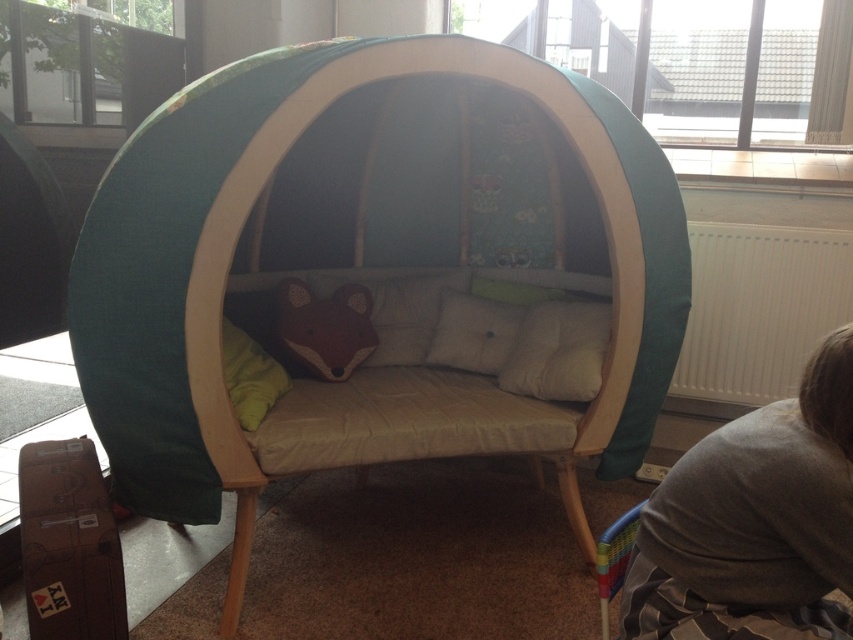
Between brown cardboard suitcase at lower left and beige fabric pillow at center, which one is positioned lower?

Positioned lower is brown cardboard suitcase at lower left.

Identify the location of brown cardboard suitcase at lower left. (68, 544).

Can you confirm if white ribbed radiator at right is taller than soft beige cushion at center?

Correct, white ribbed radiator at right is much taller as soft beige cushion at center.

Can you confirm if white ribbed radiator at right is positioned above soft beige cushion at center?

Indeed, white ribbed radiator at right is positioned over soft beige cushion at center.

Who is more distant from viewer, (x=802, y=300) or (x=555, y=385)?

Point (x=802, y=300)

Locate an element on the screen. This screenshot has width=853, height=640. white ribbed radiator at right is located at coordinates (759, 307).

Is teal fabric tent at center closer to the viewer compared to white ribbed radiator at right?

Yes, it is in front of white ribbed radiator at right.

At what (x,y) coordinates should I click in order to perform the action: click on teal fabric tent at center. Please return your answer as a coordinate pair (x, y). The width and height of the screenshot is (853, 640). Looking at the image, I should click on (367, 266).

Find the location of a particular element. Image resolution: width=853 pixels, height=640 pixels. teal fabric tent at center is located at coordinates (367, 266).